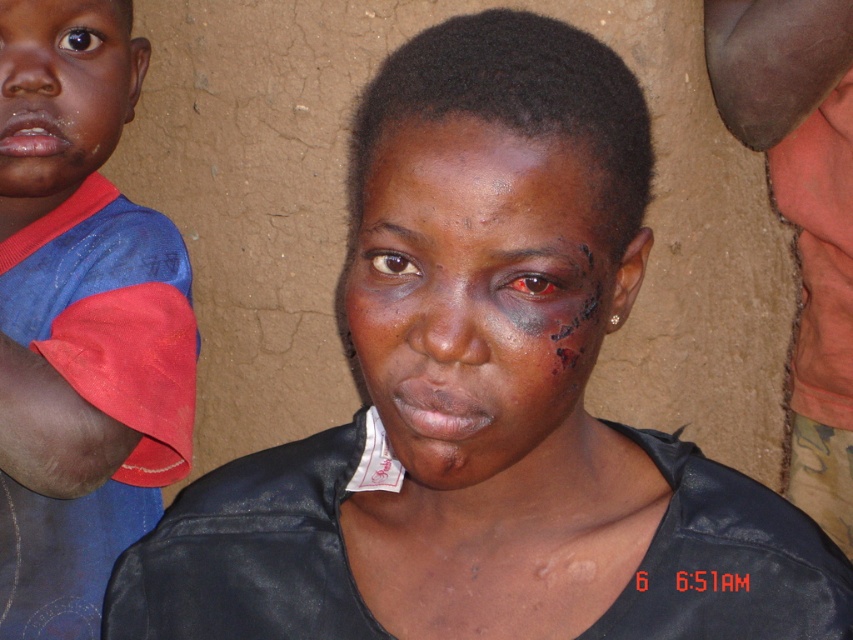
Is blue cotton shirt at left shorter than matte skin face at upper left?

No, blue cotton shirt at left is not shorter than matte skin face at upper left.

Who is more forward, (67, 557) or (70, 122)?

Point (70, 122)

Is point (143, 410) farther from camera compared to point (7, 28)?

No.

The width and height of the screenshot is (853, 640). Identify the location of blue cotton shirt at left. (80, 320).

Can you confirm if blue cotton shirt at left is smaller than dry skin at center?

Incorrect, blue cotton shirt at left is not smaller in size than dry skin at center.

Can you confirm if blue cotton shirt at left is wider than dry skin at center?

Correct, the width of blue cotton shirt at left exceeds that of dry skin at center.

Measure the distance between blue cotton shirt at left and camera.

blue cotton shirt at left and camera are 1.06 meters apart from each other.

At what (x,y) coordinates should I click in order to perform the action: click on blue cotton shirt at left. Please return your answer as a coordinate pair (x, y). Image resolution: width=853 pixels, height=640 pixels. Looking at the image, I should click on (80, 320).

Which is more to the right, matte skin face at center or matte skin face at upper left?

From the viewer's perspective, matte skin face at center appears more on the right side.

Between point (563, 173) and point (86, 19), which one is positioned behind?

The point (86, 19) is behind.

Locate an element on the screen. matte skin face at center is located at coordinates (480, 296).